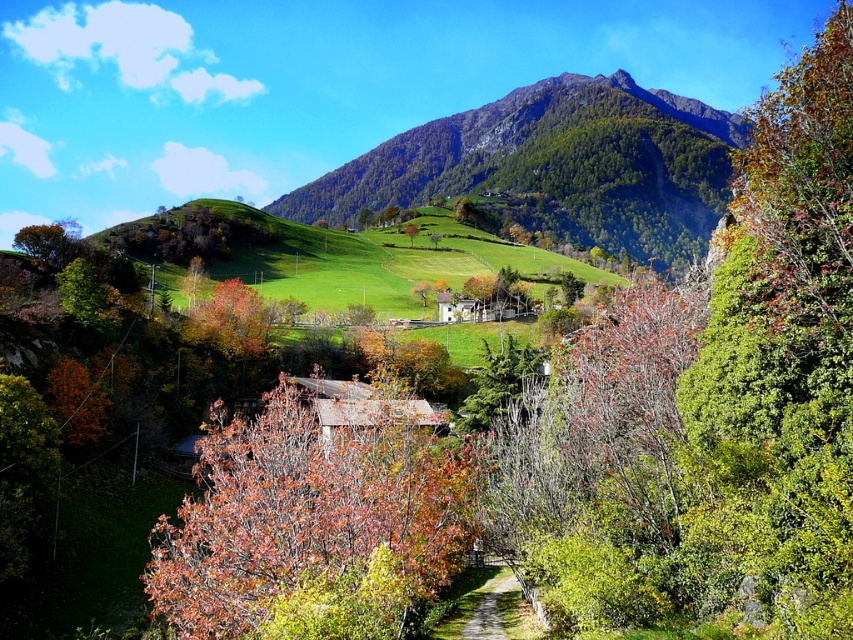
You are standing at the origin point of the image. Which direction should you move to reach the brown matte tree at center?

The brown matte tree at center is located at point coordinates of 0.823 on the x axis and 0.367 on the y axis. Since the origin is at the bottom left corner of the image, you should move to the right and slightly upwards to reach it.

You are standing at the point marked as point (x=312, y=525) in the image. What object are you standing on?

You are standing on the brown matte tree at center.

You are an artist planning to paint the two trees in the center of the scene. You know that the brown matte tree at center is taller than the green leafy tree at center. When sketching their positions, how should you arrange their heights to accurately represent the scene?

The brown matte tree at center should be drawn taller than the green leafy tree at center since it has a greater height compared to the green leafy tree at center.